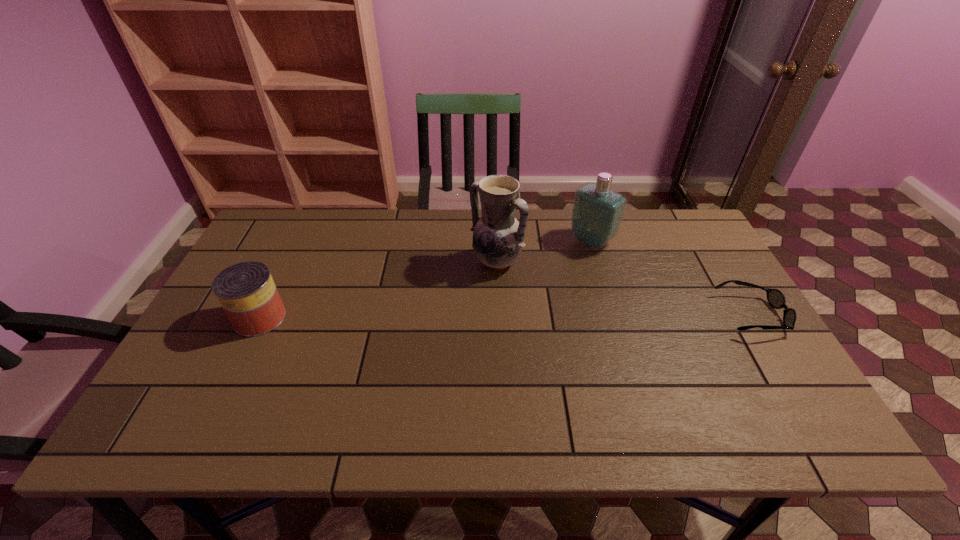
What are the coordinates of `the second shortest object` in the screenshot? It's located at (246, 291).

The height and width of the screenshot is (540, 960). What are the coordinates of `can` in the screenshot? It's located at click(x=246, y=291).

You are a GUI agent. You are given a task and a screenshot of the screen. Output one action in this format:
    pyautogui.click(x=<x>, y=<y>)
    Task: Click on the sunglasses
    
    Given the screenshot: What is the action you would take?
    pyautogui.click(x=775, y=297)

Image resolution: width=960 pixels, height=540 pixels. What are the coordinates of `the shortest object` in the screenshot? It's located at (775, 297).

Locate an element on the screen. pottery is located at coordinates (498, 236).

I want to click on the third shortest object, so click(597, 213).

Locate an element on the screen. perfume is located at coordinates (597, 213).

At what (x,y) coordinates should I click in order to perform the action: click on free location located 0.190m on the back of the can. Please return your answer as a coordinate pair (x, y). Image resolution: width=960 pixels, height=540 pixels. Looking at the image, I should click on (290, 255).

This screenshot has height=540, width=960. In order to click on free point located on either side of the second object from left to right in this screenshot , I will do `click(407, 346)`.

The width and height of the screenshot is (960, 540). What are the coordinates of `vacant space located 0.100m on either side of the second object from left to right` in the screenshot? It's located at (461, 295).